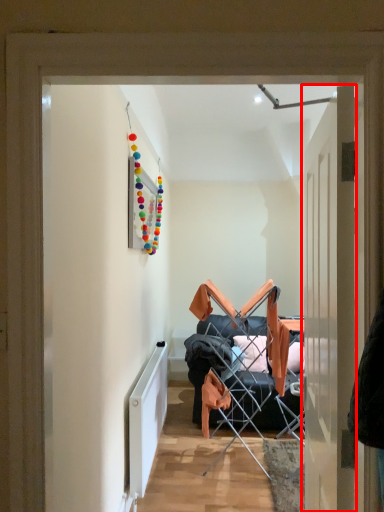
Question: From the image's perspective, what is the correct spatial relationship of door (annotated by the red box) in relation to radiator?

Choices:
 (A) above
 (B) below

Answer: (A)